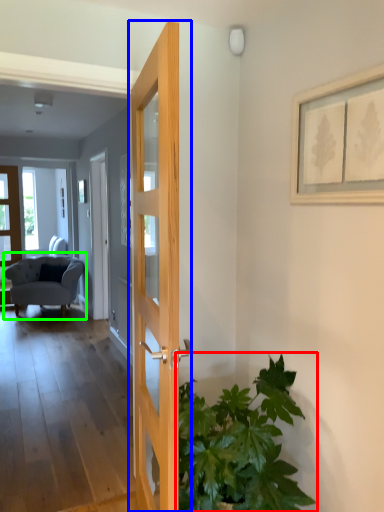
Question: Which object is the closest to the houseplant (highlighted by a red box)? Choose among these: door (highlighted by a blue box) or chair (highlighted by a green box).

Choices:
 (A) door
 (B) chair

Answer: (A)